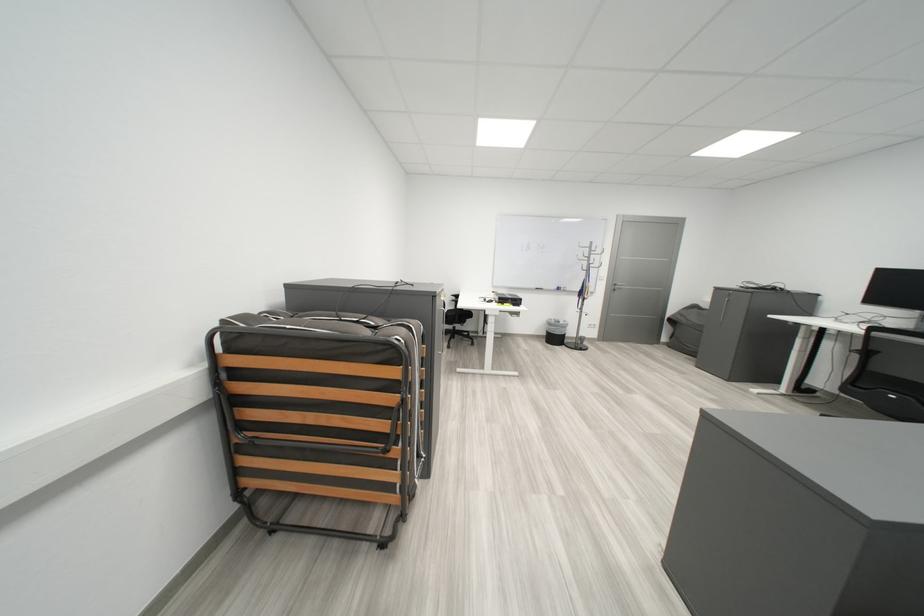
What do you see at coordinates (554, 331) in the screenshot? The width and height of the screenshot is (924, 616). I see `a black trash can` at bounding box center [554, 331].